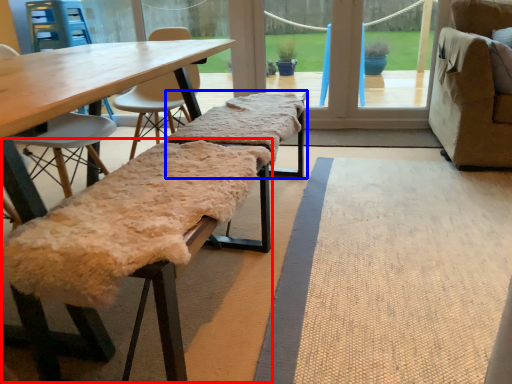
Question: Which object appears closest to the camera in this image, park bench (highlighted by a red box) or park bench (highlighted by a blue box)?

Choices:
 (A) park bench
 (B) park bench

Answer: (A)